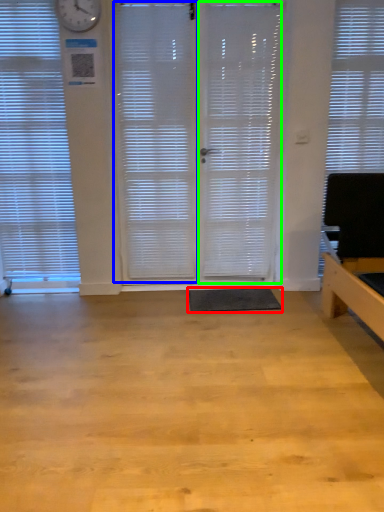
Question: Which object is the farthest from flat (highlighted by a red box)? Choose among these: shutter (highlighted by a blue box) or screen door (highlighted by a green box).

Choices:
 (A) shutter
 (B) screen door

Answer: (A)